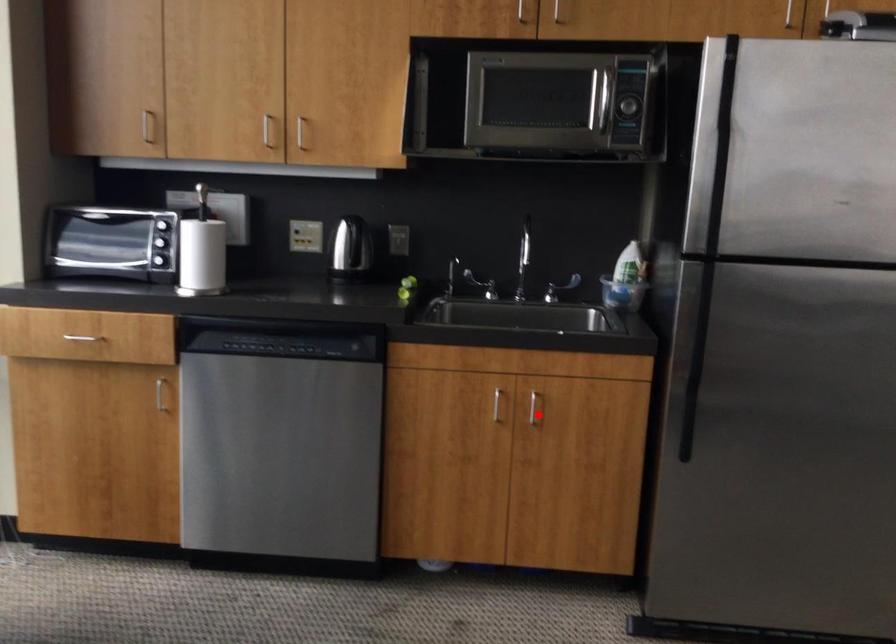
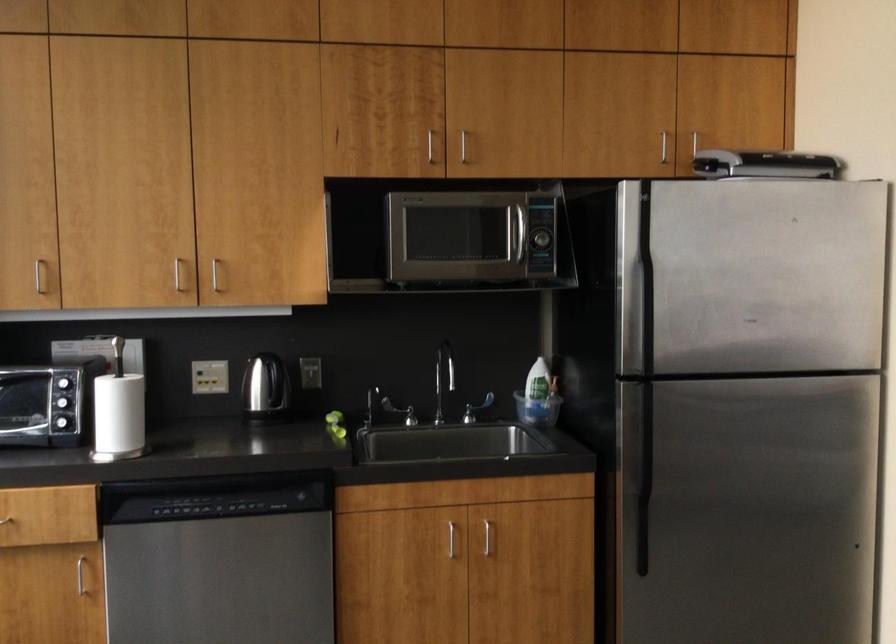
In the second image, find the point that corresponds to the highlighted location in the first image.

(490, 542)